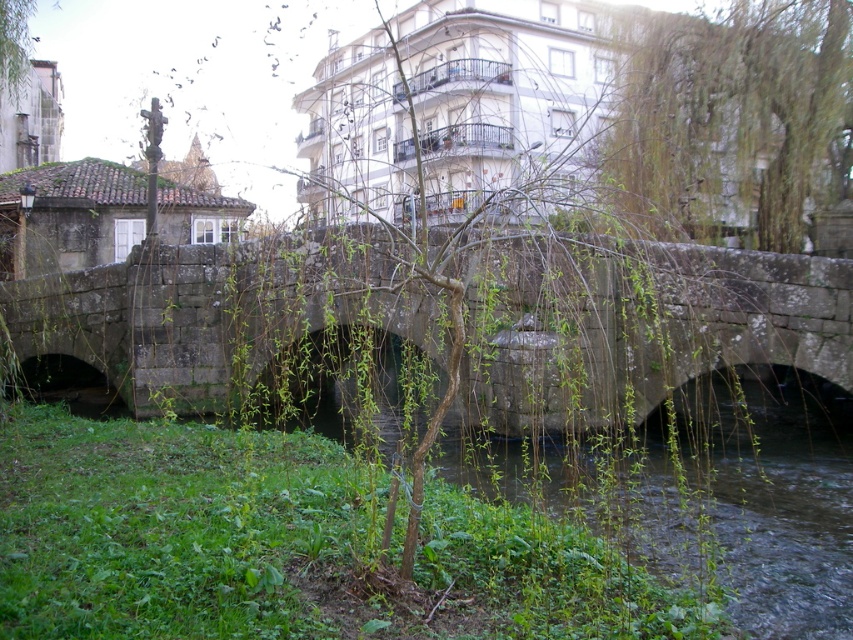
Question: Can you confirm if stone bridge at center is thinner than green leafy tree at upper right?

Choices:
 (A) no
 (B) yes

Answer: (A)

Question: Is stone bridge at center wider than green leafy tree at upper right?

Choices:
 (A) yes
 (B) no

Answer: (A)

Question: Which of the following is the closest to the observer?

Choices:
 (A) green leafy tree at upper right
 (B) stone bridge at center

Answer: (B)

Question: Is stone bridge at center to the right of green leafy tree at upper right from the viewer's perspective?

Choices:
 (A) yes
 (B) no

Answer: (B)